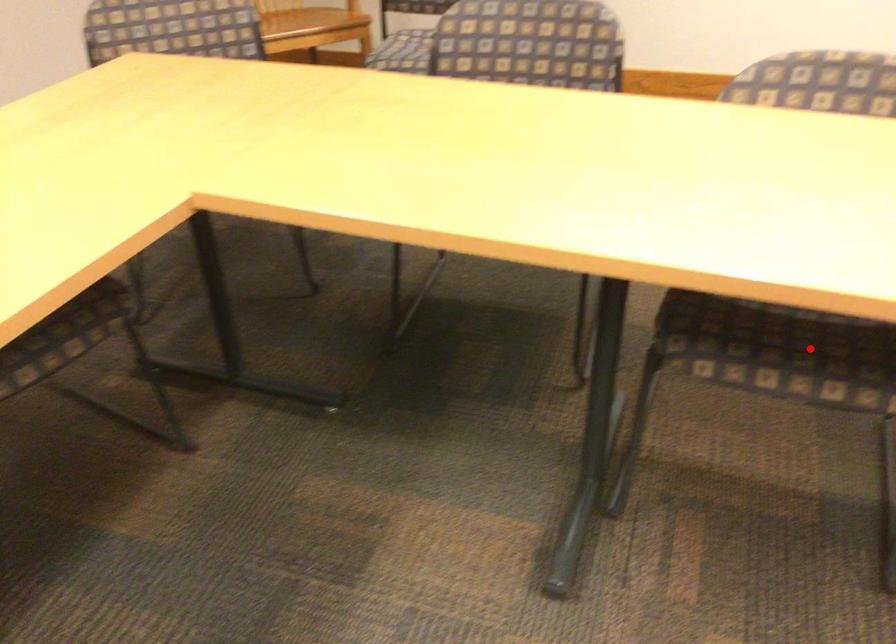
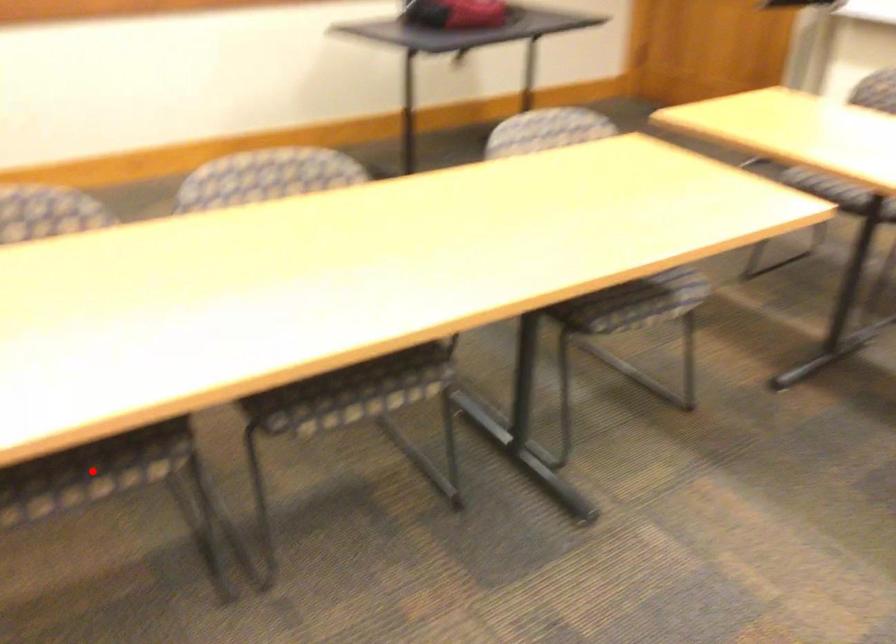
I am providing you with two images of the same scene from different viewpoints. A red point is marked on the first image and another point is marked on the second image. Does the point marked in image1 correspond to the same location as the one in image2?

Yes